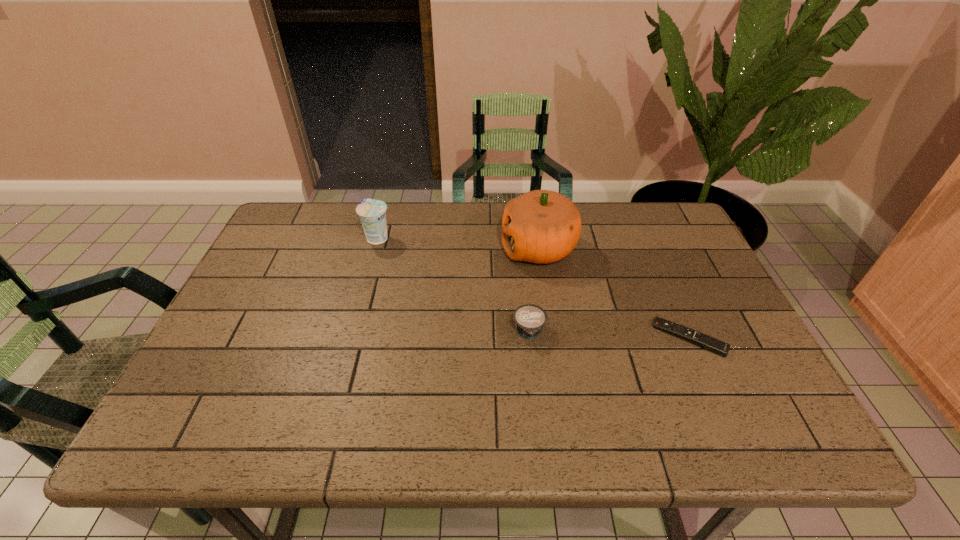
Locate an element on the screen. The image size is (960, 540). blank area at the far left corner is located at coordinates (264, 242).

Where is `vacant point at the near left corner`? vacant point at the near left corner is located at coordinates (233, 407).

In the image, there is a desktop. At what (x,y) coordinates should I click in order to perform the action: click on free region at the far right corner. Please return your answer as a coordinate pair (x, y). Image resolution: width=960 pixels, height=540 pixels. Looking at the image, I should click on [x=664, y=234].

You are a GUI agent. You are given a task and a screenshot of the screen. Output one action in this format:
    pyautogui.click(x=<x>, y=<y>)
    Task: Click on the vacant space in between the second tallest object and the tallest object
    Image resolution: width=960 pixels, height=540 pixels.
    Given the screenshot: What is the action you would take?
    pyautogui.click(x=458, y=243)

The height and width of the screenshot is (540, 960). I want to click on free space between the nearer yogurt and the tallest object, so click(x=534, y=290).

The image size is (960, 540). What are the coordinates of `free space between the left yogurt and the pumpkin` in the screenshot? It's located at (458, 243).

Where is `vacant space in between the remote control and the taller yogurt`? This screenshot has height=540, width=960. vacant space in between the remote control and the taller yogurt is located at coordinates (533, 288).

At what (x,y) coordinates should I click in order to perform the action: click on free space between the leftmost object and the remote control. Please return your answer as a coordinate pair (x, y). Looking at the image, I should click on (533, 288).

Where is `vacant space that is in between the rightmost object and the shorter yogurt`? This screenshot has height=540, width=960. vacant space that is in between the rightmost object and the shorter yogurt is located at coordinates (609, 335).

Identify the location of free space between the remote control and the leftmost object. (533, 288).